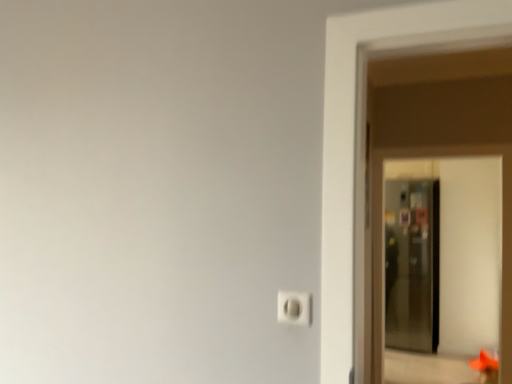
I want to click on white plastic light switch at lower center, so point(294,308).

Describe the element at coordinates (294, 308) in the screenshot. This screenshot has height=384, width=512. I see `white plastic light switch at lower center` at that location.

Measure the distance between transparent glass screen door at right and camera.

4.66 meters.

Identify the location of transparent glass screen door at right. The width and height of the screenshot is (512, 384). [x=412, y=264].

In order to face transparent glass screen door at right, should I rotate leftwards or rightwards?

It's best to rotate right around 19.709 degrees.

This screenshot has height=384, width=512. What do you see at coordinates (412, 264) in the screenshot? I see `transparent glass screen door at right` at bounding box center [412, 264].

Where is `white plastic light switch at lower center`? white plastic light switch at lower center is located at coordinates (294, 308).

Between transparent glass screen door at right and white plastic light switch at lower center, which one appears on the right side from the viewer's perspective?

transparent glass screen door at right is more to the right.

Is transparent glass screen door at right further to the viewer compared to white plastic light switch at lower center?

Yes, the depth of transparent glass screen door at right is greater than that of white plastic light switch at lower center.

Does point (428, 272) appear closer or farther from the camera than point (300, 315)?

Clearly, point (428, 272) is more distant from the camera than point (300, 315).

From the image's perspective, is transparent glass screen door at right below white plastic light switch at lower center?

Yes, from the image's perspective, transparent glass screen door at right is below white plastic light switch at lower center.

From a real-world perspective, which object rests below the other?

transparent glass screen door at right, from a real-world perspective.

Which object is wider, transparent glass screen door at right or white plastic light switch at lower center?

Wider between the two is transparent glass screen door at right.

Considering the sizes of objects transparent glass screen door at right and white plastic light switch at lower center in the image provided, who is taller, transparent glass screen door at right or white plastic light switch at lower center?

transparent glass screen door at right.

Which of these two, transparent glass screen door at right or white plastic light switch at lower center, is bigger?

With larger size is transparent glass screen door at right.

Is white plastic light switch at lower center a part of transparent glass screen door at right?

That's incorrect, white plastic light switch at lower center is not inside transparent glass screen door at right.

Is transparent glass screen door at right beside white plastic light switch at lower center?

No, transparent glass screen door at right is not beside white plastic light switch at lower center.

From the picture: Is transparent glass screen door at right oriented towards white plastic light switch at lower center?

Yes.

How many degrees apart are the facing directions of transparent glass screen door at right and white plastic light switch at lower center?

The angular difference between transparent glass screen door at right and white plastic light switch at lower center is 3.9 degrees.

Find the location of a particular element. screen door located below the white plastic light switch at lower center (from the image's perspective) is located at coordinates (412, 264).

Considering the positions of objects white plastic light switch at lower center and transparent glass screen door at right in the image provided, who is more to the left, white plastic light switch at lower center or transparent glass screen door at right?

Positioned to the left is white plastic light switch at lower center.

Considering the relative positions of white plastic light switch at lower center and transparent glass screen door at right in the image provided, is white plastic light switch at lower center in front of transparent glass screen door at right?

Yes, white plastic light switch at lower center is closer to the camera.

Considering the positions of point (280, 308) and point (409, 292), is point (280, 308) closer or farther from the camera than point (409, 292)?

Point (280, 308) is closer to the camera than point (409, 292).

From the image's perspective, is white plastic light switch at lower center located above or below transparent glass screen door at right?

white plastic light switch at lower center is above transparent glass screen door at right.

From a real-world perspective, between white plastic light switch at lower center and transparent glass screen door at right, who is vertically higher?

From a 3D spatial view, white plastic light switch at lower center is above.

Does white plastic light switch at lower center have a greater width compared to transparent glass screen door at right?

No, white plastic light switch at lower center is not wider than transparent glass screen door at right.

Can you confirm if white plastic light switch at lower center is shorter than transparent glass screen door at right?

Yes, white plastic light switch at lower center is shorter than transparent glass screen door at right.

Does white plastic light switch at lower center have a larger size compared to transparent glass screen door at right?

No.

Is white plastic light switch at lower center completely or partially outside of transparent glass screen door at right?

Yes.

Is white plastic light switch at lower center placed right next to transparent glass screen door at right?

No, white plastic light switch at lower center is not in contact with transparent glass screen door at right.

Could you tell me if white plastic light switch at lower center is facing transparent glass screen door at right?

No, white plastic light switch at lower center is not turned towards transparent glass screen door at right.

How different are the orientations of white plastic light switch at lower center and transparent glass screen door at right in degrees?

The angle between the facing direction of white plastic light switch at lower center and the facing direction of transparent glass screen door at right is 3.9 degrees.

Image resolution: width=512 pixels, height=384 pixels. Identify the location of screen door behind the white plastic light switch at lower center. (412, 264).

Locate an element on the screen. Image resolution: width=512 pixels, height=384 pixels. light switch located on the left of transparent glass screen door at right is located at coordinates (294, 308).

Image resolution: width=512 pixels, height=384 pixels. What are the coordinates of `light switch above the transparent glass screen door at right (from the image's perspective)` in the screenshot? It's located at (294, 308).